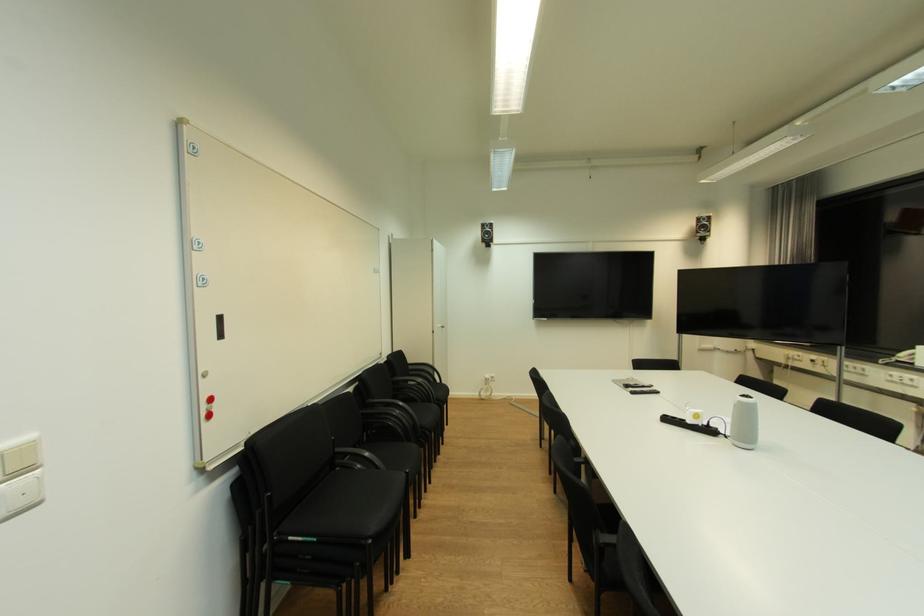
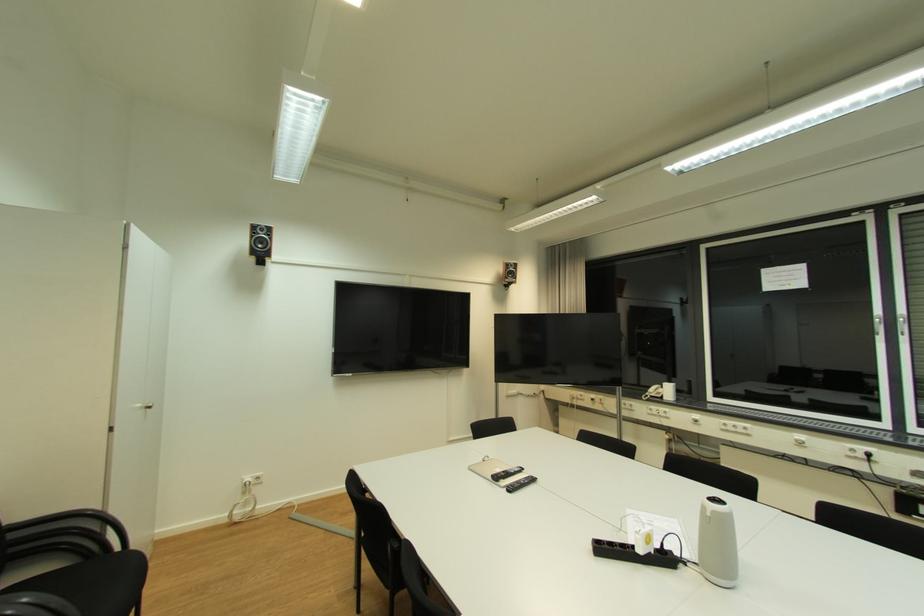
Locate, in the second image, the point that corresponds to (x=489, y=227) in the first image.

(261, 228)